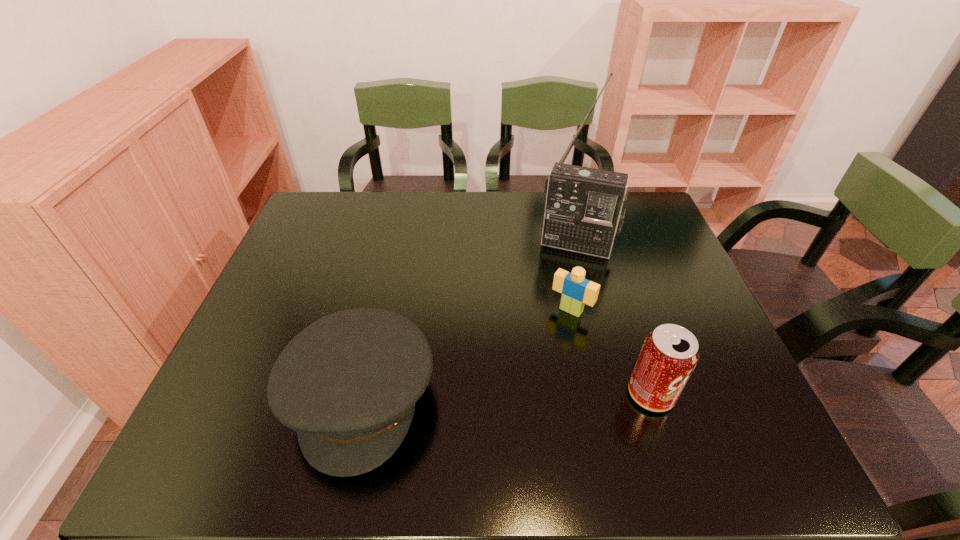
Locate an element on the screen. free space on the desktop that is between the leftmost object and the soda can and is positioned on the display of the radio receiver is located at coordinates (535, 395).

Identify the location of free spot on the desktop that is between the leftmost object and the soda can and is positioned on the face of the Lego. The image size is (960, 540). (510, 396).